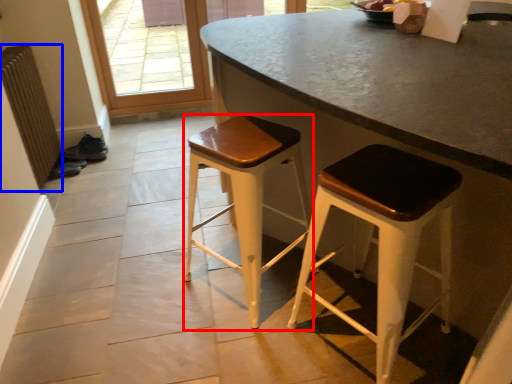
Question: Among these objects, which one is farthest to the camera, stool (highlighted by a red box) or radiator (highlighted by a blue box)?

Choices:
 (A) stool
 (B) radiator

Answer: (B)